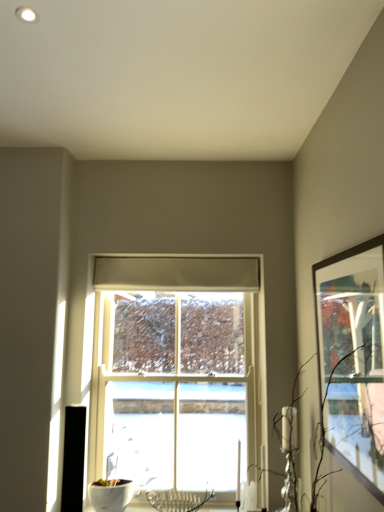
What do you see at coordinates (353, 358) in the screenshot?
I see `matte black picture frame at right` at bounding box center [353, 358].

Identify the location of white wooden window at center. (177, 370).

Where is `matte black picture frame at right`? matte black picture frame at right is located at coordinates (353, 358).

Is matte black picture frame at right positioned with its back to white wooden window at center?

No, white wooden window at center is not at the back of matte black picture frame at right.

From the image's perspective, is matte black picture frame at right located above or below white wooden window at center?

matte black picture frame at right is situated higher than white wooden window at center in the image.

Is matte black picture frame at right not close to white wooden window at center?

Yes, matte black picture frame at right and white wooden window at center are quite far apart.

Consider the image. Is matte black picture frame at right inside the boundaries of white wooden window at center, or outside?

matte black picture frame at right is spatially situated outside white wooden window at center.

How much distance is there between white wooden window at center and matte black picture frame at right?

The distance of white wooden window at center from matte black picture frame at right is 1.13 meters.

From the image's perspective, is white wooden window at center under matte black picture frame at right?

Correct, white wooden window at center appears lower than matte black picture frame at right in the image.

Considering the sizes of objects white wooden window at center and matte black picture frame at right in the image provided, who is shorter, white wooden window at center or matte black picture frame at right?

With less height is matte black picture frame at right.

Is point (194, 318) less distant than point (322, 422)?

No, (194, 318) is behind (322, 422).

Which of these two, matte black picture frame at right or brown matte branch at right, is wider?

Wider between the two is brown matte branch at right.

Based on the photo, is matte black picture frame at right turned away from brown matte branch at right?

That's not correct — matte black picture frame at right is not looking away from brown matte branch at right.

Would you say matte black picture frame at right is a long distance from brown matte branch at right?

They are positioned close to each other.

Is brown matte branch at right wider or thinner than white wooden window at center?

Considering their sizes, brown matte branch at right looks broader than white wooden window at center.

Is brown matte branch at right to the left or to the right of white wooden window at center in the image?

From the image, it's evident that brown matte branch at right is to the right of white wooden window at center.

From a real-world perspective, is brown matte branch at right above or below white wooden window at center?

Clearly, from a real-world perspective, brown matte branch at right is below white wooden window at center.

Which object is closer to the camera, white wooden window at center or brown matte branch at right?

brown matte branch at right is in front.

Considering the relative positions of white wooden window at center and brown matte branch at right in the image provided, is white wooden window at center to the right of brown matte branch at right from the viewer's perspective?

No.

From the image's perspective, which is below, white wooden window at center or brown matte branch at right?

white wooden window at center, from the image's perspective.

From a real-world perspective, does white wooden window at center sit lower than brown matte branch at right?

Answer: No, from a real-world perspective, white wooden window at center is not below brown matte branch at right.

Looking at this image, looking at the image, does brown matte branch at right seem bigger or smaller compared to matte black picture frame at right?

Clearly, brown matte branch at right is larger in size than matte black picture frame at right.

From the image's perspective, does brown matte branch at right appear higher than matte black picture frame at right?

No.

Can you confirm if brown matte branch at right is wider than matte black picture frame at right?

Yes, brown matte branch at right is wider than matte black picture frame at right.

Is brown matte branch at right looking in the opposite direction of matte black picture frame at right?

That's right, brown matte branch at right is facing away from matte black picture frame at right.

In order to click on picture frame that appears in front of the white wooden window at center in this screenshot , I will do `click(353, 358)`.

You are a GUI agent. You are given a task and a screenshot of the screen. Output one action in this format:
    pyautogui.click(x=<x>, y=<y>)
    Task: Click on the window below the matte black picture frame at right (from a real-world perspective)
    
    Given the screenshot: What is the action you would take?
    pyautogui.click(x=177, y=370)

Considering their positions, is matte black picture frame at right positioned closer to brown matte branch at right than white wooden window at center?

matte black picture frame at right.

Looking at the image, which one is located closer to matte black picture frame at right, brown matte branch at right or white wooden window at center?

Based on the image, brown matte branch at right appears to be nearer to matte black picture frame at right.

Looking at the image, which one is located further to matte black picture frame at right, white wooden window at center or brown matte branch at right?

white wooden window at center is further to matte black picture frame at right.

Which object lies nearer to the anchor point white wooden window at center, matte black picture frame at right or brown matte branch at right?

brown matte branch at right is positioned closer to the anchor white wooden window at center.

Which object lies further to the anchor point brown matte branch at right, white wooden window at center or matte black picture frame at right?

white wooden window at center lies further to brown matte branch at right than the other object.

Based on their spatial positions, is brown matte branch at right or matte black picture frame at right closer to white wooden window at center?

The object closer to white wooden window at center is brown matte branch at right.

Where is `branch between matte black picture frame at right and white wooden window at center in the front-back direction`? Image resolution: width=384 pixels, height=512 pixels. branch between matte black picture frame at right and white wooden window at center in the front-back direction is located at coordinates (319, 465).